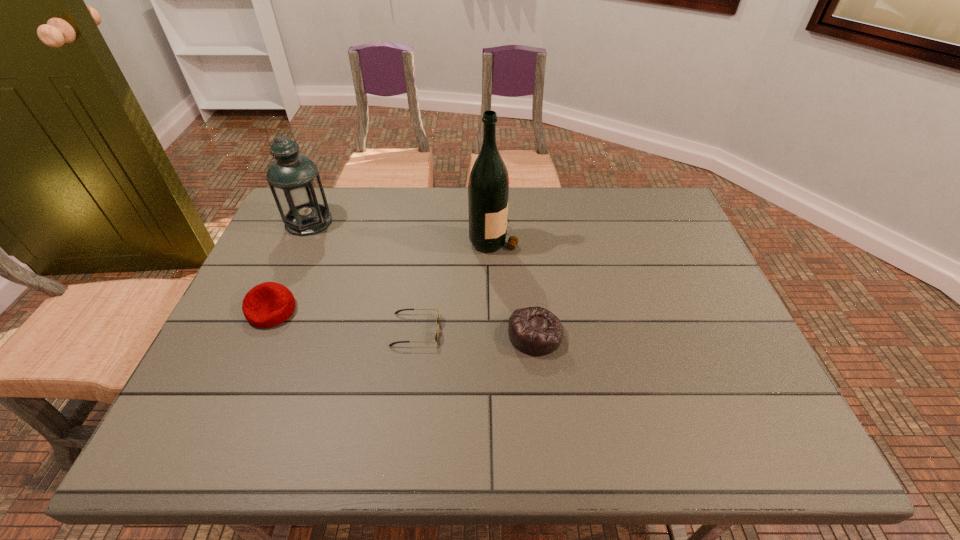
Identify the location of free space that is in between the wine bottle and the oil lamp. Image resolution: width=960 pixels, height=540 pixels. (401, 230).

This screenshot has height=540, width=960. I want to click on free spot between the left beanbag and the wine bottle, so click(x=383, y=274).

The image size is (960, 540). I want to click on vacant area between the wine bottle and the fourth shortest object, so (x=401, y=230).

Locate an element on the screen. This screenshot has height=540, width=960. blank region between the fourth shortest object and the right beanbag is located at coordinates (421, 278).

This screenshot has height=540, width=960. Identify the location of free space between the left beanbag and the sunglasses. (344, 320).

Where is `free space between the wine bottle and the right beanbag`? The height and width of the screenshot is (540, 960). free space between the wine bottle and the right beanbag is located at coordinates (515, 286).

At what (x,y) coordinates should I click in order to perform the action: click on unoccupied position between the fourth shortest object and the wine bottle. Please return your answer as a coordinate pair (x, y). Looking at the image, I should click on (x=401, y=230).

At what (x,y) coordinates should I click in order to perform the action: click on vacant area between the left beanbag and the right beanbag. Please return your answer as a coordinate pair (x, y). This screenshot has width=960, height=540. Looking at the image, I should click on (403, 322).

Where is `unoccupied area between the right beanbag and the left beanbag`? The height and width of the screenshot is (540, 960). unoccupied area between the right beanbag and the left beanbag is located at coordinates (403, 322).

Find the location of `empty space that is in between the sunglasses and the fourth shortest object`. empty space that is in between the sunglasses and the fourth shortest object is located at coordinates (362, 276).